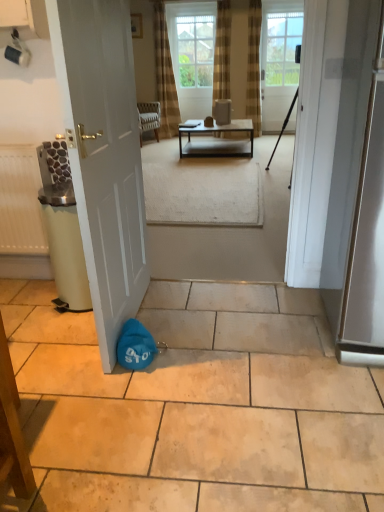
Question: Should I look upward or downward to see matte white coffee cup at upper left?

Choices:
 (A) down
 (B) up

Answer: (B)

Question: Is matte white radiator at left at the left side of matte blue bag at lower left?

Choices:
 (A) yes
 (B) no

Answer: (A)

Question: Can you confirm if matte white radiator at left is shorter than matte blue bag at lower left?

Choices:
 (A) yes
 (B) no

Answer: (B)

Question: From a real-world perspective, is matte white radiator at left over matte blue bag at lower left?

Choices:
 (A) no
 (B) yes

Answer: (B)

Question: Is matte white radiator at left further to the viewer compared to matte blue bag at lower left?

Choices:
 (A) no
 (B) yes

Answer: (B)

Question: Considering the relative sizes of matte white radiator at left and matte blue bag at lower left in the image provided, is matte white radiator at left thinner than matte blue bag at lower left?

Choices:
 (A) yes
 (B) no

Answer: (A)

Question: From a real-world perspective, does matte white radiator at left sit lower than matte blue bag at lower left?

Choices:
 (A) no
 (B) yes

Answer: (A)

Question: Is metallic silver screen door at right bigger than metallic black table at center?

Choices:
 (A) no
 (B) yes

Answer: (B)

Question: Does metallic silver screen door at right appear on the left side of metallic black table at center?

Choices:
 (A) yes
 (B) no

Answer: (B)

Question: Could you tell me if metallic silver screen door at right is facing metallic black table at center?

Choices:
 (A) yes
 (B) no

Answer: (B)

Question: Considering the relative positions of metallic silver screen door at right and metallic black table at center in the image provided, is metallic silver screen door at right to the right of metallic black table at center from the viewer's perspective?

Choices:
 (A) yes
 (B) no

Answer: (A)

Question: Is metallic silver screen door at right thinner than metallic black table at center?

Choices:
 (A) yes
 (B) no

Answer: (A)

Question: Is metallic silver screen door at right positioned behind metallic black table at center?

Choices:
 (A) no
 (B) yes

Answer: (A)

Question: Does clear glass window screen at upper center have a greater width compared to metallic silver screen door at right?

Choices:
 (A) no
 (B) yes

Answer: (A)